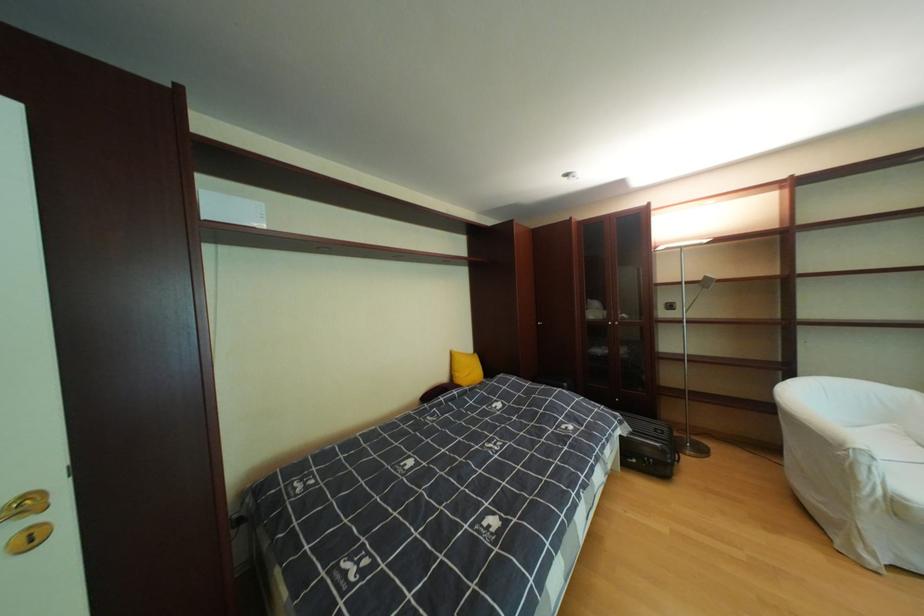
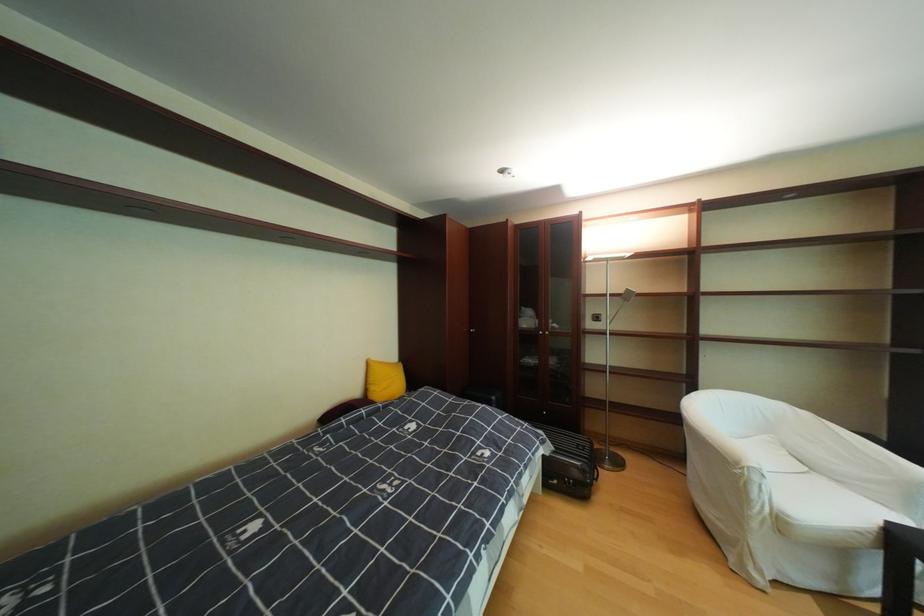
Where in the second image is the point corresponding to point (687, 310) from the first image?

(612, 322)